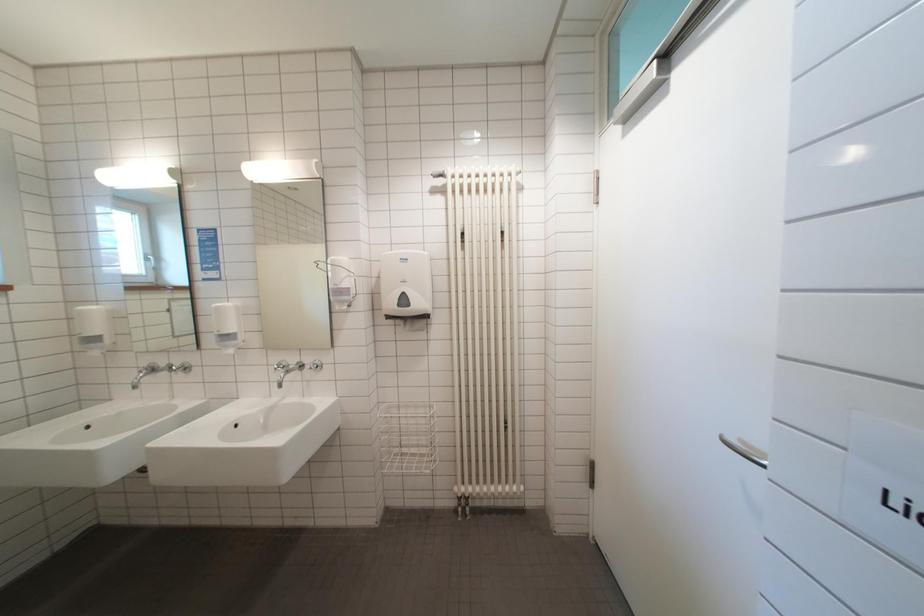
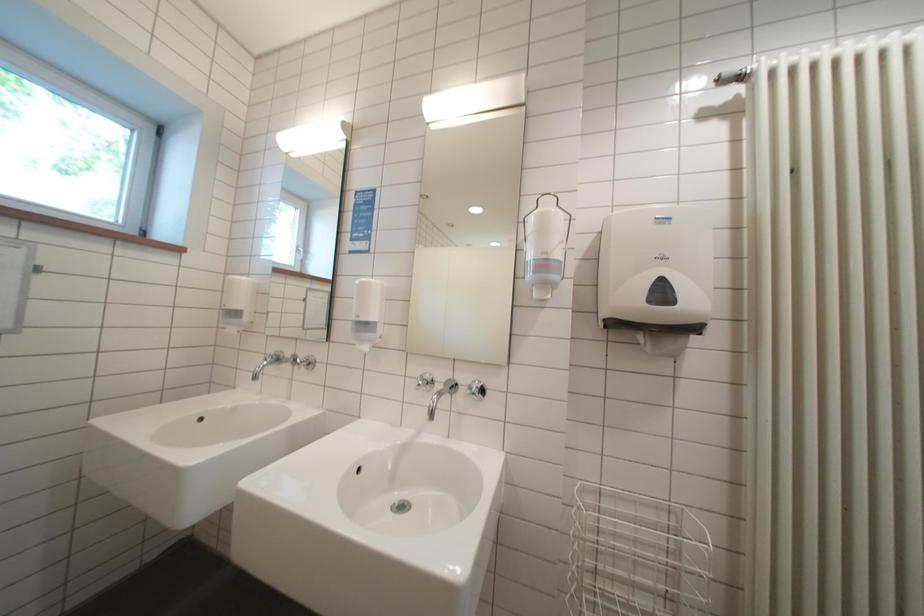
Question: How did the camera likely rotate?

Choices:
 (A) Left
 (B) Right
 (C) Up
 (D) Down

Answer: (A)